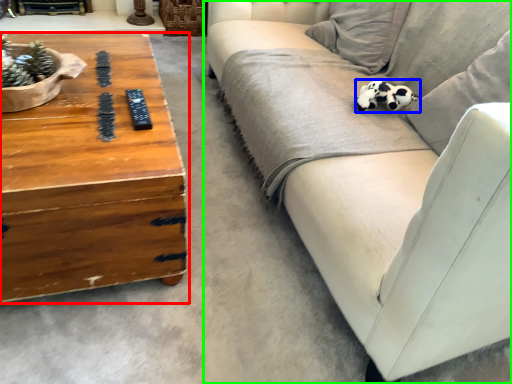
Question: Considering the real-world distances, which object is farthest from coffee table (highlighted by a red box)? animal (highlighted by a blue box) or studio couch (highlighted by a green box)?

Choices:
 (A) animal
 (B) studio couch

Answer: (A)